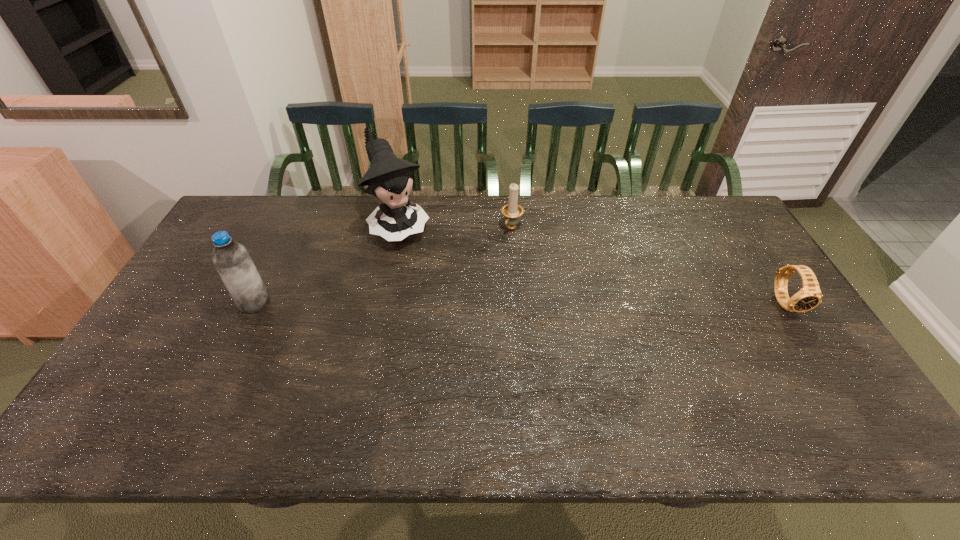
The width and height of the screenshot is (960, 540). In order to click on empty space that is in between the doll and the rightmost object in this screenshot , I will do `click(592, 265)`.

You are a GUI agent. You are given a task and a screenshot of the screen. Output one action in this format:
    pyautogui.click(x=<x>, y=<y>)
    Task: Click on the vacant area between the second object from right to left and the watch
    This screenshot has width=960, height=540.
    Given the screenshot: What is the action you would take?
    pyautogui.click(x=649, y=265)

Image resolution: width=960 pixels, height=540 pixels. In order to click on unoccupied area between the watch and the candle_holder in this screenshot , I will do `click(649, 265)`.

I want to click on free space between the doll and the second tallest object, so click(327, 265).

Image resolution: width=960 pixels, height=540 pixels. In order to click on vacant space that's between the rightmost object and the third object from left to right in this screenshot , I will do `click(649, 265)`.

Locate an element on the screen. Image resolution: width=960 pixels, height=540 pixels. object that is the third nearest to the candle_holder is located at coordinates (809, 296).

The image size is (960, 540). I want to click on object that is the third closest to the third tallest object, so click(809, 296).

This screenshot has width=960, height=540. In order to click on blank space that satisfies the following two spatial constraints: 1. on the front side of the second object from left to right; 2. on the left side of the candle_holder in this screenshot , I will do `click(399, 228)`.